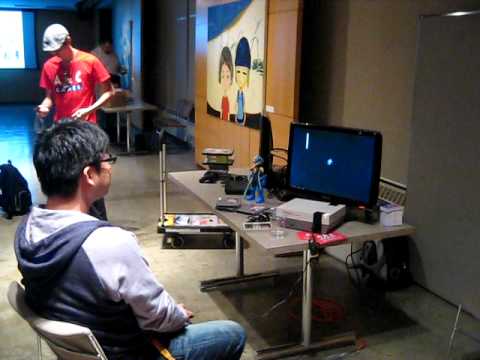
Identify the location of walls. (468, 39), (71, 24).